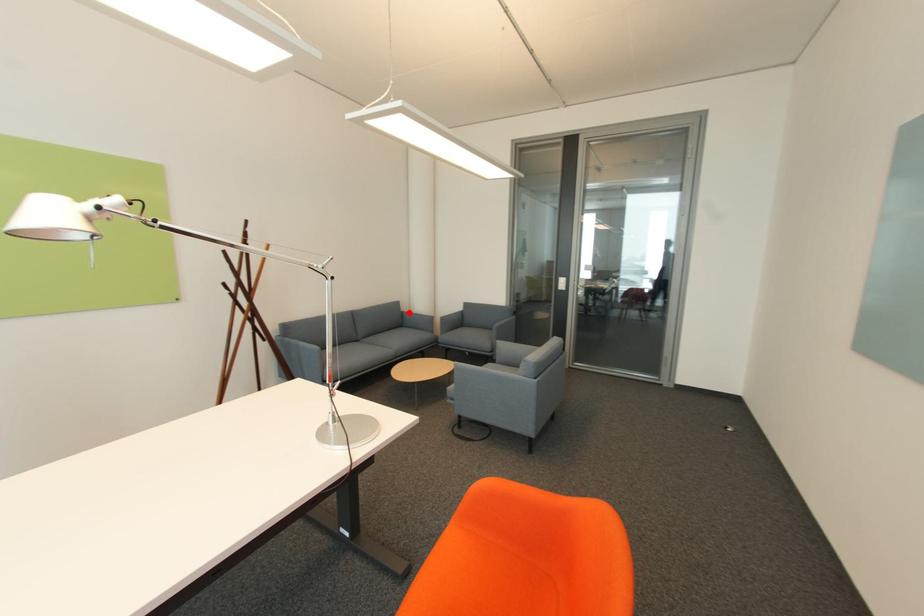
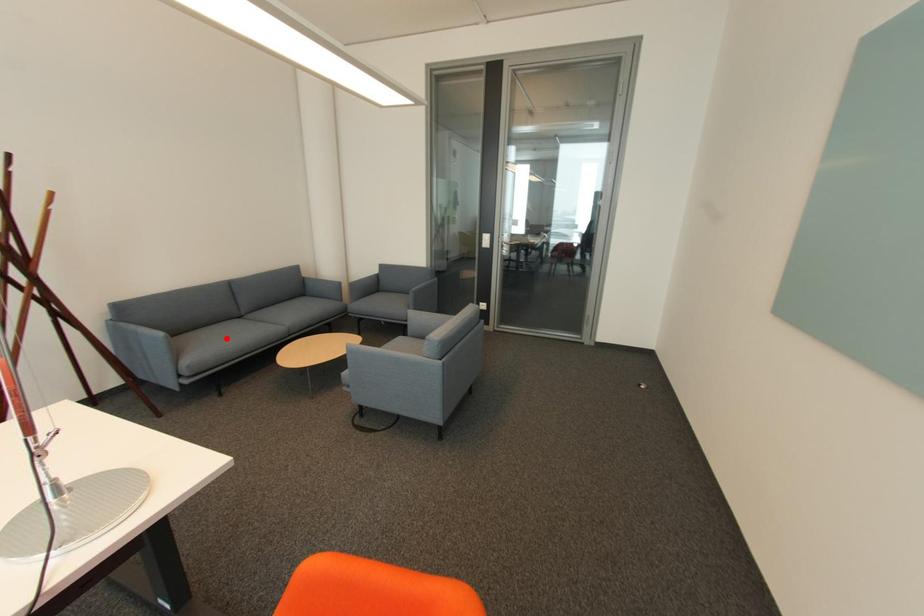
I am providing you with two images of the same scene from different viewpoints. A red point is marked on the first image and another point is marked on the second image. Is the red point in image1 aligned with the point shown in image2?

No